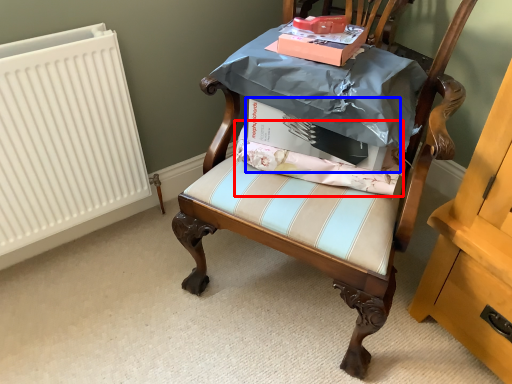
Question: Which object is closer to the camera taking this photo, fabric (highlighted by a red box) or cardboard box (highlighted by a blue box)?

Choices:
 (A) fabric
 (B) cardboard box

Answer: (B)